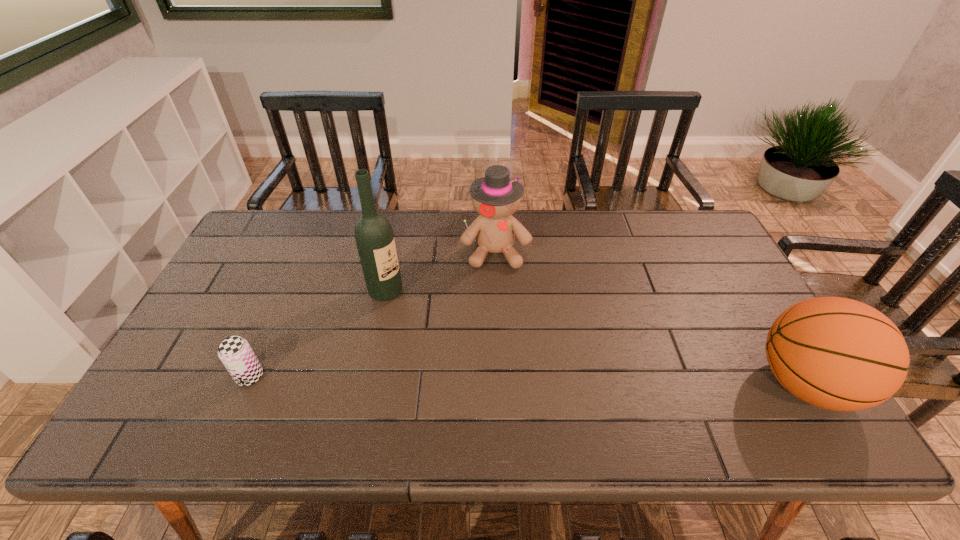
The image size is (960, 540). Identify the location of vacant region located 0.220m on the front-facing side of the farthest object. tap(504, 327).

Image resolution: width=960 pixels, height=540 pixels. Find the location of `vacant region located on the front-facing side of the farthest object`. vacant region located on the front-facing side of the farthest object is located at coordinates [500, 292].

I want to click on vacant position located 0.250m on the labeled side of the third object from right to left, so click(464, 345).

The width and height of the screenshot is (960, 540). What are the coordinates of `vacant space situated 0.220m on the labeled side of the third object from right to left` in the screenshot? It's located at (455, 339).

Where is `vacant space located on the labeled side of the third object from right to left`? The height and width of the screenshot is (540, 960). vacant space located on the labeled side of the third object from right to left is located at coordinates click(x=500, y=369).

The width and height of the screenshot is (960, 540). Find the location of `object at the far edge`. object at the far edge is located at coordinates (496, 197).

Locate an element on the screen. The width and height of the screenshot is (960, 540). beer can present at the near edge is located at coordinates (236, 354).

Image resolution: width=960 pixels, height=540 pixels. I want to click on basketball that is at the near edge, so click(x=836, y=353).

Locate an element on the screen. The height and width of the screenshot is (540, 960). object located at the right edge is located at coordinates click(x=836, y=353).

At what (x,y) coordinates should I click in order to perform the action: click on object that is at the near right corner. Please return your answer as a coordinate pair (x, y). The width and height of the screenshot is (960, 540). Looking at the image, I should click on (836, 353).